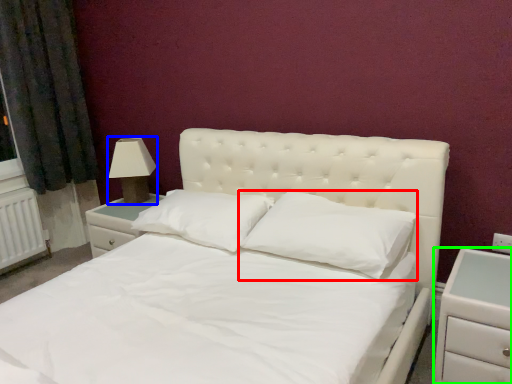
Question: Which object is positioned closest to pillow (highlighted by a red box)? Select from lamp (highlighted by a blue box) and nightstand (highlighted by a green box).

Choices:
 (A) lamp
 (B) nightstand

Answer: (B)